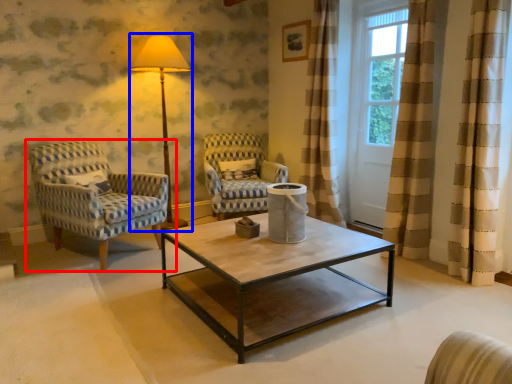
Question: Which point is closer to the camera, chair (highlighted by a red box) or table lamp (highlighted by a blue box)?

Choices:
 (A) chair
 (B) table lamp

Answer: (A)